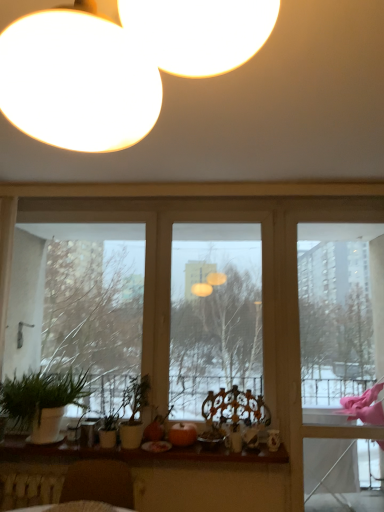
Question: Is green matte plant at lower left not inside green matte plant at center, which is counted as the second houseplant, starting from the left?

Choices:
 (A) no
 (B) yes

Answer: (B)

Question: Can you confirm if green matte plant at lower left is shorter than green matte plant at center, which is counted as the second houseplant, starting from the left?

Choices:
 (A) no
 (B) yes

Answer: (A)

Question: Is green matte plant at lower left aimed at green matte plant at center, which ranks as the first houseplant in right-to-left order?

Choices:
 (A) yes
 (B) no

Answer: (A)

Question: Does green matte plant at lower left have a larger size compared to green matte plant at center, which is counted as the second houseplant, starting from the left?

Choices:
 (A) no
 (B) yes

Answer: (B)

Question: From a real-world perspective, is green matte plant at lower left on green matte plant at center, which is counted as the second houseplant, starting from the left?

Choices:
 (A) yes
 (B) no

Answer: (A)

Question: Would you say green matte plant at lower left is inside or outside green matte plant at center, which is counted as the second houseplant, starting from the left?

Choices:
 (A) inside
 (B) outside

Answer: (B)

Question: Does point (178, 243) appear closer or farther from the camera than point (132, 439)?

Choices:
 (A) closer
 (B) farther

Answer: (B)

Question: From a real-world perspective, is green matte plant at lower left physically located above or below green matte plant at center, which ranks as the first houseplant in right-to-left order?

Choices:
 (A) below
 (B) above

Answer: (B)

Question: From the image's perspective, is green matte plant at lower left positioned above or below green matte plant at center, which is counted as the second houseplant, starting from the left?

Choices:
 (A) below
 (B) above

Answer: (B)

Question: Visually, is green matte plant at lower left, which is the 1th houseplant in left-to-right order, positioned to the left or to the right of wooden round table at lower left?

Choices:
 (A) right
 (B) left

Answer: (B)

Question: From the image's perspective, is green matte plant at lower left, which is the 1th houseplant in left-to-right order, above or below wooden round table at lower left?

Choices:
 (A) above
 (B) below

Answer: (A)

Question: Choose the correct answer: Is green matte plant at lower left, which is the 1th houseplant in left-to-right order, inside wooden round table at lower left or outside it?

Choices:
 (A) inside
 (B) outside

Answer: (B)

Question: In the image, is green matte plant at lower left, the 2th houseplant from the right, positioned in front of or behind wooden round table at lower left?

Choices:
 (A) front
 (B) behind

Answer: (B)

Question: Choose the correct answer: Is wooden at lower center inside pink fabric at right or outside it?

Choices:
 (A) inside
 (B) outside

Answer: (B)

Question: Is wooden at lower center in front of or behind pink fabric at right in the image?

Choices:
 (A) behind
 (B) front

Answer: (B)